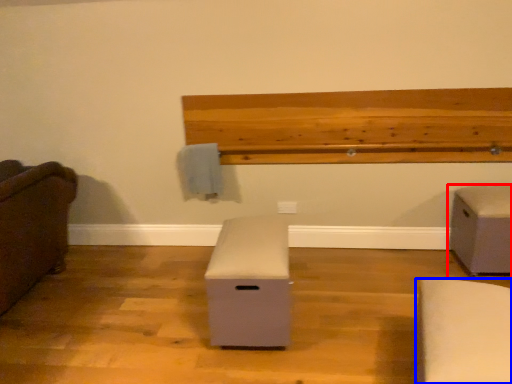
Question: Which object is closer to the camera taking this photo, furniture (highlighted by a red box) or furniture (highlighted by a blue box)?

Choices:
 (A) furniture
 (B) furniture

Answer: (B)